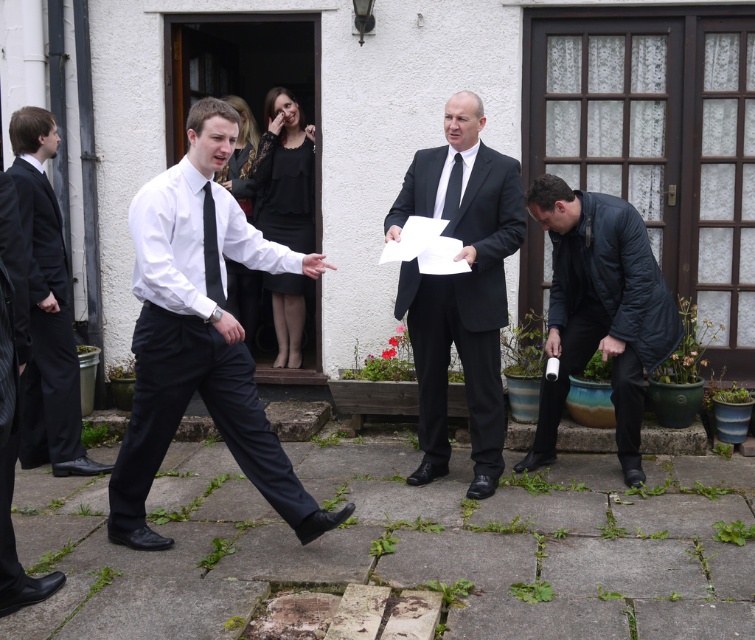
You are standing at the origin point of the image. A man in a matte black suit is at point (45,307). If you want to walk directly towards him, which direction should you move? Please provide your answer in terms of coordinates relative to the image plane, where the origin is the bottom left corner of the image.

To move directly towards the matte black suit at left located at point (45,307) from the origin, you should move in the direction of increasing x and y coordinates. Since the point has an x value of 0.481 and y value of 0.062, you would need to move rightward along the x axis and slightly upward along the y axis to reach him.